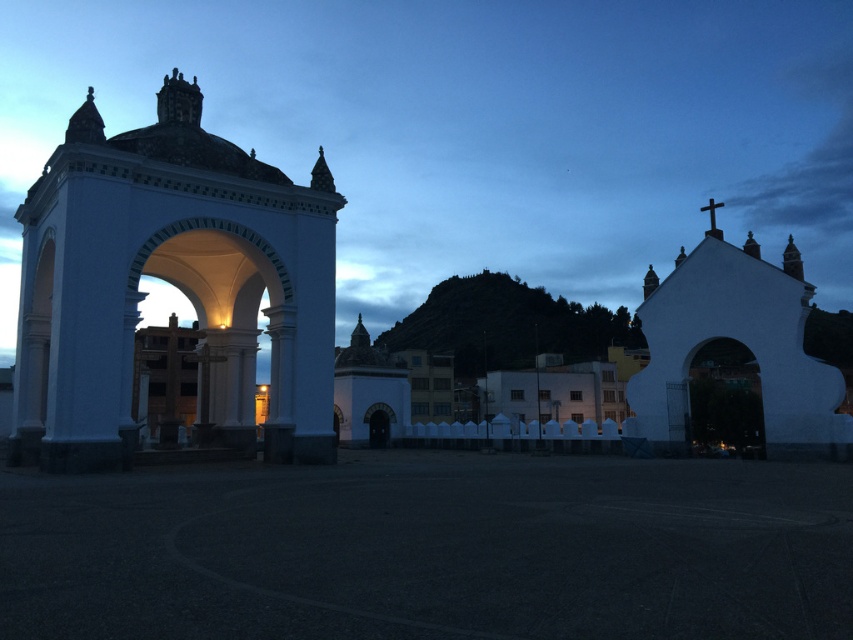
Question: Which of the following is the closest to the observer?

Choices:
 (A) white matte church at right
 (B) white stone arch at left

Answer: (B)

Question: Can you confirm if white stone arch at left is wider than white matte church at right?

Choices:
 (A) yes
 (B) no

Answer: (A)

Question: Can you confirm if white stone arch at left is positioned to the left of white matte church at right?

Choices:
 (A) yes
 (B) no

Answer: (A)

Question: Does white stone arch at left appear on the left side of white matte church at right?

Choices:
 (A) no
 (B) yes

Answer: (B)